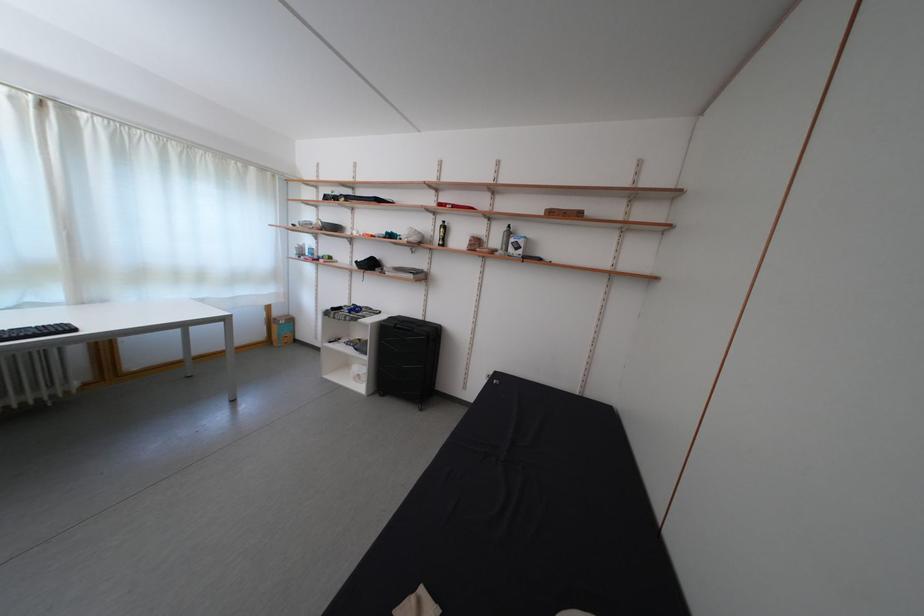
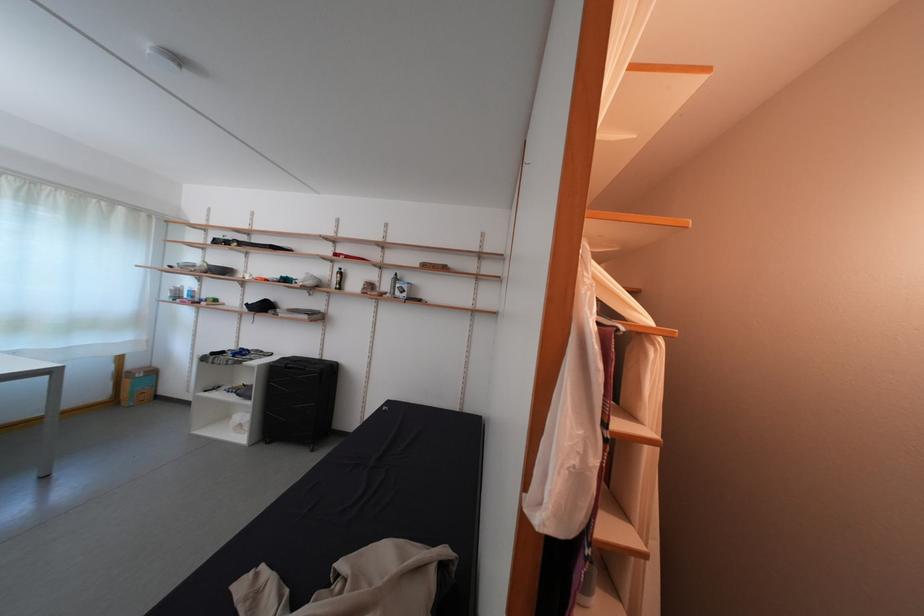
Find the pixel in the second image that matches (442,241) in the first image.

(339, 286)